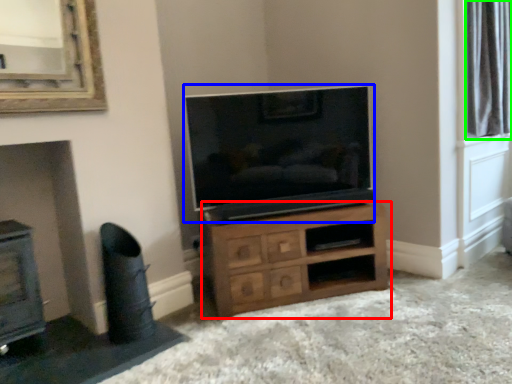
Question: Estimate the real-world distances between objects in this image. Which object is closer to chest of drawers (highlighted by a red box), television (highlighted by a blue box) or bay window (highlighted by a green box)?

Choices:
 (A) television
 (B) bay window

Answer: (A)